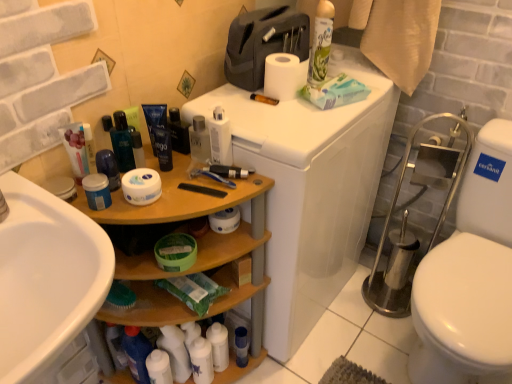
Where is `vacant space to the right of blue matte jar at left, which ranks as the 2th toiletry in left-to-right order`? The image size is (512, 384). vacant space to the right of blue matte jar at left, which ranks as the 2th toiletry in left-to-right order is located at coordinates (168, 200).